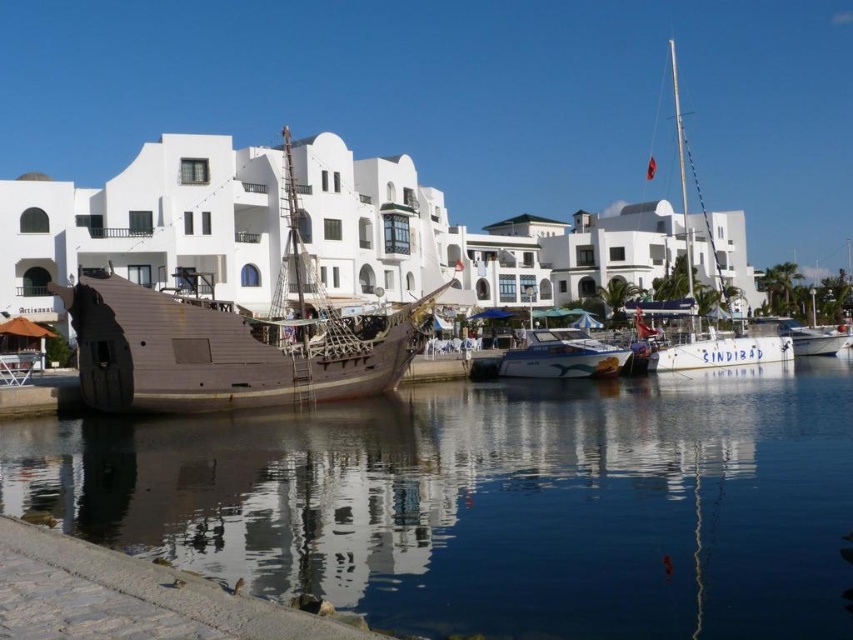
You are a tourist planning to take a photo of the white matte building at center and the wooden pirate ship at center from a distance. Which object will appear wider in your photo?

The white matte building at center will appear wider in the photo because its width surpasses that of the wooden pirate ship at center according to the description.

From the picture: You are standing at the waterfront and want to take a photo that includes both point A at point (131, 257) and point B at point (786, 346). Which point will appear larger in your camera view?

Point A at point (131, 257) will appear larger in the camera view because it is closer to the camera than point B at point (786, 346).

You are a tourist standing at the waterfront and want to take a photo of both the white matte building at center and the white glossy sailboat at center. Which object should you position closer to the camera to ensure both are in focus?

Since the white matte building at center is in front of the white glossy sailboat at center, you should position the camera closer to the building to ensure both are in focus.